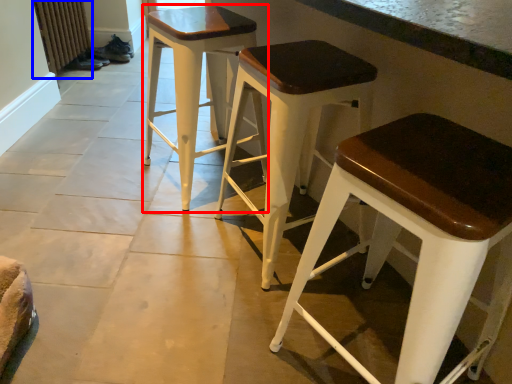
Question: Which of the following is the farthest to the observer, stool (highlighted by a red box) or radiator (highlighted by a blue box)?

Choices:
 (A) stool
 (B) radiator

Answer: (B)